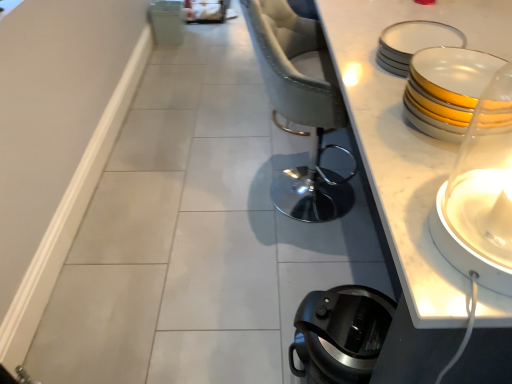
Question: Is sleek gray fabric chair at center positioned beyond the bounds of black plastic coffee pot at lower right?

Choices:
 (A) yes
 (B) no

Answer: (A)

Question: Considering the relative sizes of sleek gray fabric chair at center and black plastic coffee pot at lower right in the image provided, is sleek gray fabric chair at center shorter than black plastic coffee pot at lower right?

Choices:
 (A) yes
 (B) no

Answer: (B)

Question: Considering the relative sizes of sleek gray fabric chair at center and black plastic coffee pot at lower right in the image provided, is sleek gray fabric chair at center bigger than black plastic coffee pot at lower right?

Choices:
 (A) no
 (B) yes

Answer: (B)

Question: From the image's perspective, would you say sleek gray fabric chair at center is positioned over black plastic coffee pot at lower right?

Choices:
 (A) yes
 (B) no

Answer: (A)

Question: Is sleek gray fabric chair at center looking in the opposite direction of black plastic coffee pot at lower right?

Choices:
 (A) no
 (B) yes

Answer: (A)

Question: Visually, is white glossy candle holder at right positioned to the left or to the right of white porcelain plates at upper right, arranged as the 2th tableware when ordered from the bottom?

Choices:
 (A) right
 (B) left

Answer: (B)

Question: From the image's perspective, is white glossy candle holder at right above or below white porcelain plates at upper right, which appears as the first tableware when viewed from the back?

Choices:
 (A) below
 (B) above

Answer: (A)

Question: In terms of width, does white glossy candle holder at right look wider or thinner when compared to white porcelain plates at upper right, which appears as the first tableware when viewed from the back?

Choices:
 (A) thin
 (B) wide

Answer: (A)

Question: Considering the positions of point tap(481, 125) and point tap(433, 26), is point tap(481, 125) closer or farther from the camera than point tap(433, 26)?

Choices:
 (A) closer
 (B) farther

Answer: (A)

Question: Considering their positions, is sleek gray fabric chair at center located in front of or behind white glossy plates at upper right, the 2th tableware positioned from the top?

Choices:
 (A) front
 (B) behind

Answer: (B)

Question: Looking at the image, does sleek gray fabric chair at center seem bigger or smaller compared to white glossy plates at upper right, the first tableware positioned from the bottom?

Choices:
 (A) small
 (B) big

Answer: (B)

Question: In terms of height, does sleek gray fabric chair at center look taller or shorter compared to white glossy plates at upper right, the 2th tableware positioned from the top?

Choices:
 (A) short
 (B) tall

Answer: (B)

Question: From a real-world perspective, is sleek gray fabric chair at center above or below white glossy plates at upper right, which appears as the first tableware when viewed from the front?

Choices:
 (A) below
 (B) above

Answer: (A)

Question: Looking at their shapes, would you say black plastic coffee pot at lower right is wider or thinner than white glossy candle holder at right?

Choices:
 (A) thin
 (B) wide

Answer: (B)

Question: From a real-world perspective, is black plastic coffee pot at lower right above or below white glossy candle holder at right?

Choices:
 (A) above
 (B) below

Answer: (B)